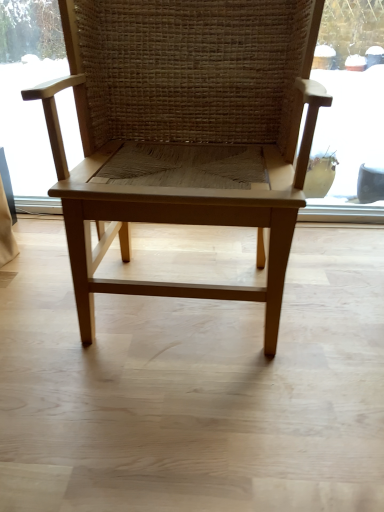
The width and height of the screenshot is (384, 512). What are the coordinates of `free point below light wood chair at center (from a real-world perspective)` in the screenshot? It's located at (183, 302).